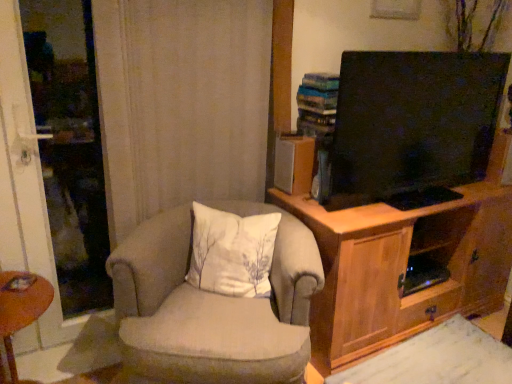
Question: Is brown wooden desk at lower left outside beige fabric chair at center?

Choices:
 (A) yes
 (B) no

Answer: (A)

Question: Can you confirm if brown wooden desk at lower left is positioned to the left of beige fabric chair at center?

Choices:
 (A) yes
 (B) no

Answer: (A)

Question: Considering the relative positions of brown wooden desk at lower left and beige fabric chair at center in the image provided, is brown wooden desk at lower left to the right of beige fabric chair at center from the viewer's perspective?

Choices:
 (A) yes
 (B) no

Answer: (B)

Question: Considering the relative sizes of brown wooden desk at lower left and beige fabric chair at center in the image provided, is brown wooden desk at lower left wider than beige fabric chair at center?

Choices:
 (A) no
 (B) yes

Answer: (A)

Question: Is brown wooden desk at lower left behind beige fabric chair at center?

Choices:
 (A) no
 (B) yes

Answer: (B)

Question: Is beige fabric chair at center wider or thinner than wooden cabinet at right?

Choices:
 (A) wide
 (B) thin

Answer: (B)

Question: Is beige fabric chair at center in front of or behind wooden cabinet at right in the image?

Choices:
 (A) front
 (B) behind

Answer: (A)

Question: Is point (281, 324) closer or farther from the camera than point (287, 87)?

Choices:
 (A) closer
 (B) farther

Answer: (A)

Question: From a real-world perspective, is beige fabric chair at center positioned above or below wooden cabinet at right?

Choices:
 (A) above
 (B) below

Answer: (B)

Question: Is white fabric pillow at center to the left or to the right of brown wooden desk at lower left in the image?

Choices:
 (A) right
 (B) left

Answer: (A)

Question: In terms of height, does white fabric pillow at center look taller or shorter compared to brown wooden desk at lower left?

Choices:
 (A) tall
 (B) short

Answer: (B)

Question: From the image's perspective, is white fabric pillow at center positioned above or below brown wooden desk at lower left?

Choices:
 (A) above
 (B) below

Answer: (A)

Question: Is white fabric pillow at center bigger or smaller than brown wooden desk at lower left?

Choices:
 (A) small
 (B) big

Answer: (B)

Question: Is beige fabric chair at center in front of or behind brown wooden desk at lower left in the image?

Choices:
 (A) behind
 (B) front

Answer: (B)

Question: Is beige fabric chair at center inside or outside of brown wooden desk at lower left?

Choices:
 (A) outside
 (B) inside

Answer: (A)